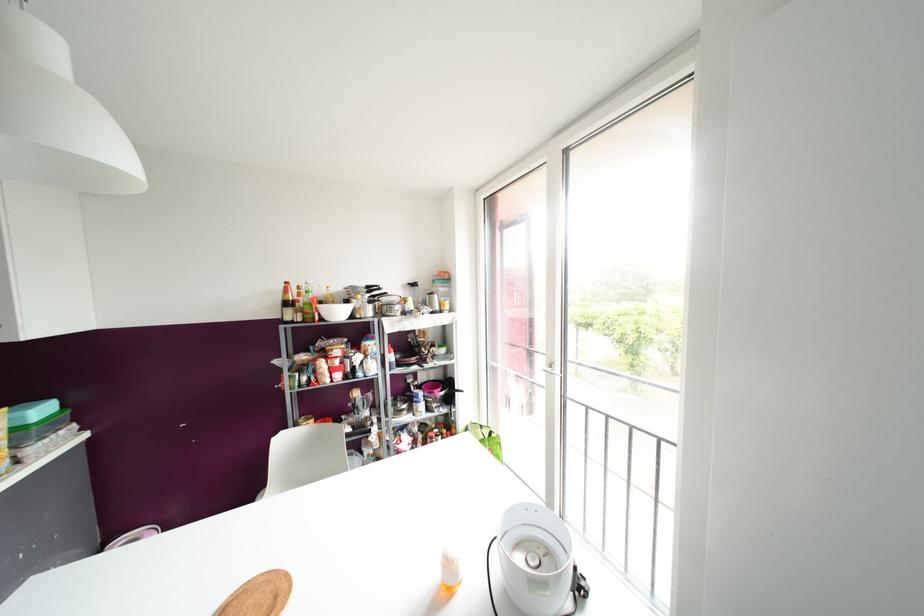
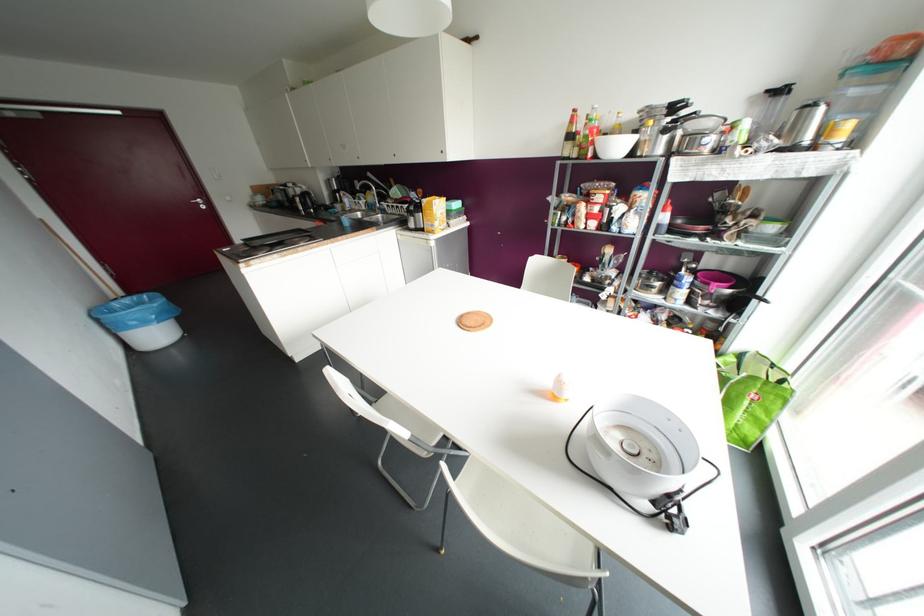
Find the pixel in the second image that matches [333,302] in the first image.

(618, 134)